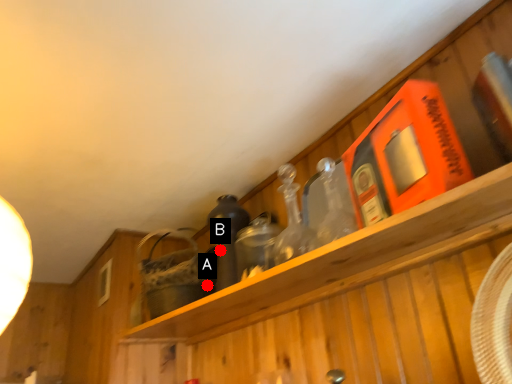
Question: Two points are circled on the image, labeled by A and B beside each circle. Which point is closer to the camera taking this photo?

Choices:
 (A) A is closer
 (B) B is closer

Answer: (B)